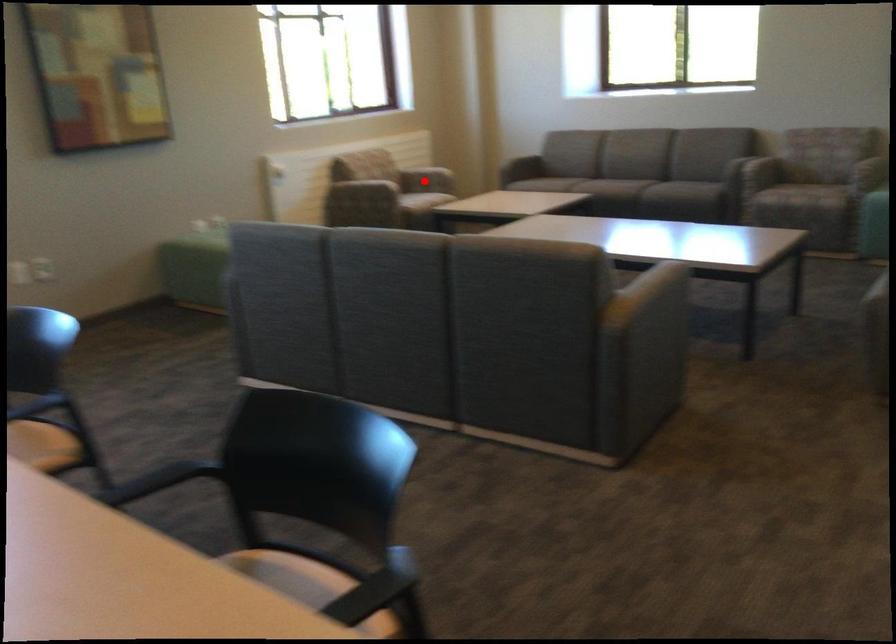
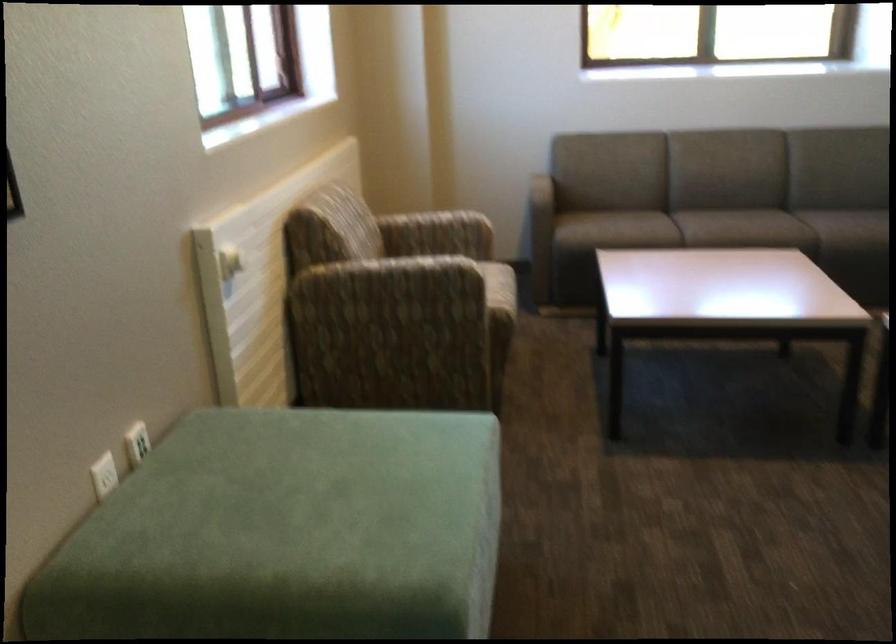
Where in the second image is the point corresponding to the highlighted location from the first image?

(458, 254)